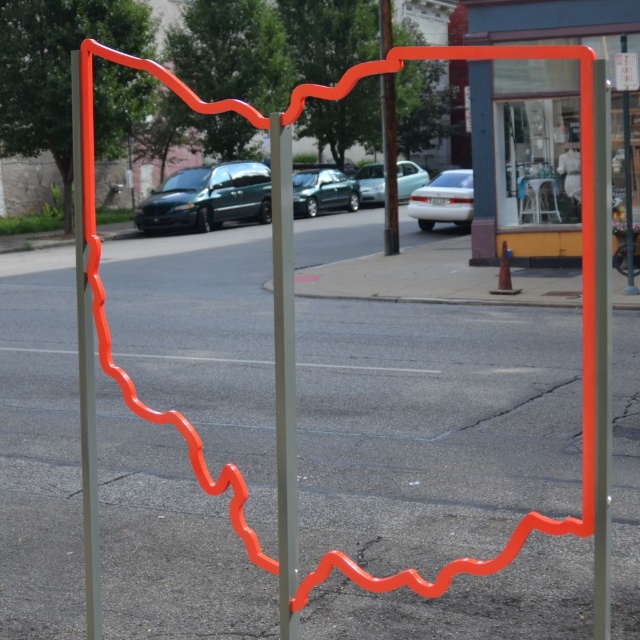
Question: Can you confirm if orange glossy swing at center is positioned to the right of matte silver sedan at center?

Choices:
 (A) no
 (B) yes

Answer: (A)

Question: Which object is the farthest from the green matte van at center?

Choices:
 (A) matte orange pole at left
 (B) metallic pole at center

Answer: (A)

Question: In this image, where is orange glossy swing at center located relative to matte silver sedan at center?

Choices:
 (A) above
 (B) below

Answer: (B)

Question: Which is farther from the orange glossy swing at center?

Choices:
 (A) metallic gray pole at center
 (B) metallic orange pole at center
 (C) metallic silver car at center

Answer: (C)

Question: Which object appears closest to the camera in this image?

Choices:
 (A) matte orange pole at left
 (B) green matte van at center
 (C) metallic green car at center
 (D) orange glossy swing at center

Answer: (A)

Question: Does matte orange pole at left have a smaller size compared to metallic green car at center?

Choices:
 (A) no
 (B) yes

Answer: (A)